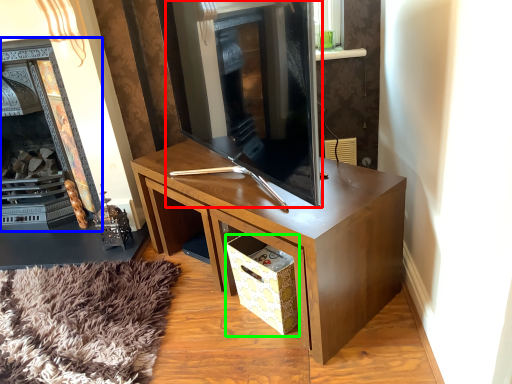
Question: Which object is the farthest from fireplace (highlighted by a red box)? Choose among these: fireplace (highlighted by a blue box) or drawer (highlighted by a green box).

Choices:
 (A) fireplace
 (B) drawer

Answer: (A)